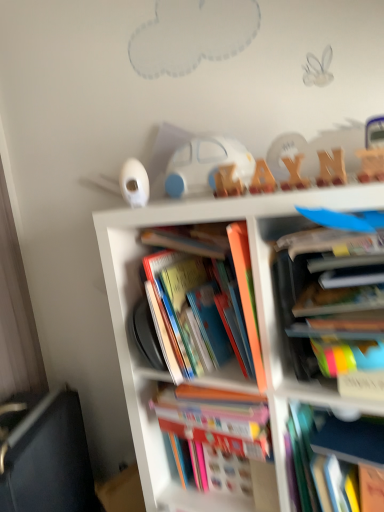
Question: From a real-world perspective, is black fabric couch at lower left positioned above or below multicolored paper book at center right, which ranks as the fifth book in bottom-to-top order?

Choices:
 (A) below
 (B) above

Answer: (A)

Question: In terms of height, does black fabric couch at lower left look taller or shorter compared to multicolored paper book at center right, which ranks as the fifth book in bottom-to-top order?

Choices:
 (A) short
 (B) tall

Answer: (B)

Question: Considering the real-world distances, which object is farthest from the white plastic car at upper center?

Choices:
 (A) hardcover books at center, which is the 1th book in bottom-to-top order
 (B) hardcover book at center, which appears as the third book when viewed from the top
 (C) hardcover book at center, marked as the fourth book in a bottom-to-top arrangement
 (D) hardcover book at center, the 2th book positioned from the bottom
 (E) black fabric couch at lower left

Answer: (E)

Question: Which object is the closest to the hardcover book at center, the 2th book positioned from the bottom?

Choices:
 (A) hardcover books at center, which is the 1th book in bottom-to-top order
 (B) multicolored paper book at center right, marked as the 1th book in a top-to-bottom arrangement
 (C) black fabric couch at lower left
 (D) multicolored cardboard books at center
 (E) hardcover book at center, marked as the fourth book in a bottom-to-top arrangement

Answer: (A)